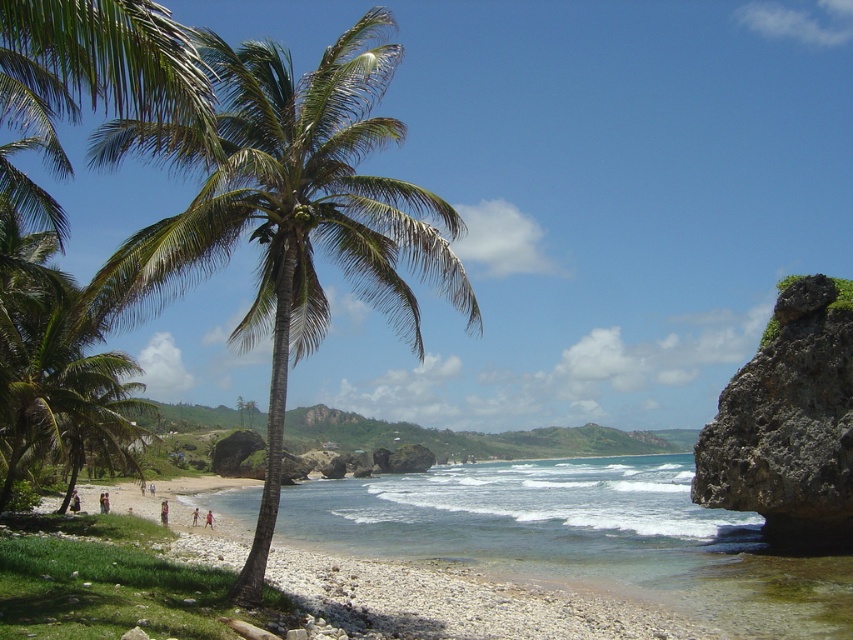
You are a photographer planning to capture a photo of the pink fabric dress at lower center and the light skin human at center. Based on their sizes, which one should you focus on to ensure it fills the frame more appropriately?

The pink fabric dress at lower center should be focused on since it has a larger size compared to the light skin human at center, making it better suited to fill the frame appropriately.

In the scene shown: You are standing on the beach and want to take a photo of the tan skin person at center without the green leafy palm tree at left blocking the view. Where should you move to achieve this?

Move to the right side of the tan skin person at center so that the green leafy palm tree at left is no longer in front of them.

You are standing on the beach and see two points marked in the image. One is at coordinate point (x=161, y=509) and the other at point (x=99, y=500). Which point is closer to you?

Point (x=161, y=509) is closer to the viewer than point (x=99, y=500).